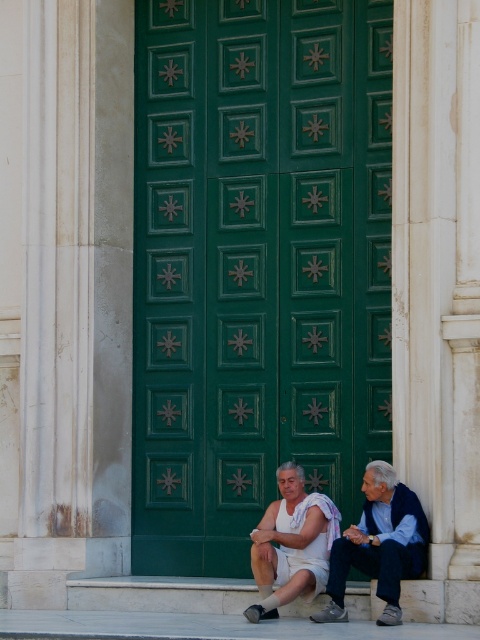
Can you confirm if green painted wood door at center is smaller than white cotton shorts at center?

No.

Does point (286, 294) come in front of point (291, 470)?

No, it is behind (291, 470).

Identify the location of green painted wood door at center. click(x=256, y=266).

Can you confirm if light blue denim jeans at lower right is positioned to the left of white cotton shorts at center?

In fact, light blue denim jeans at lower right is to the right of white cotton shorts at center.

Which of these two, light blue denim jeans at lower right or white cotton shorts at center, stands taller?

light blue denim jeans at lower right is taller.

Which is in front, point (336, 563) or point (278, 522)?

Point (336, 563) is more forward.

You are a GUI agent. You are given a task and a screenshot of the screen. Output one action in this format:
    pyautogui.click(x=<x>, y=<y>)
    Task: Click on the light blue denim jeans at lower right
    The height and width of the screenshot is (640, 480).
    Given the screenshot: What is the action you would take?
    pyautogui.click(x=379, y=545)

Can you confirm if green painted wood door at center is thinner than light blue denim jeans at lower right?

No.

Which is in front, point (233, 493) or point (365, 508)?

Point (365, 508)

Between point (175, 310) and point (421, 556), which one is positioned behind?

Point (175, 310)

Where is `green painted wood door at center`? green painted wood door at center is located at coordinates (256, 266).